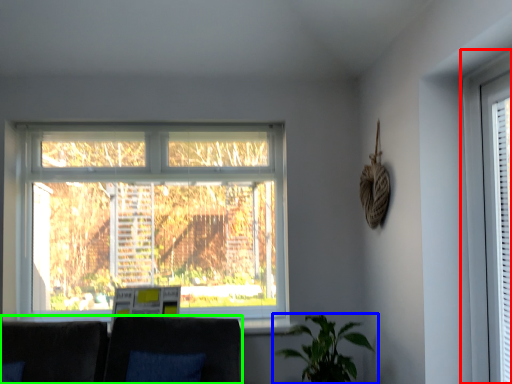
Question: Considering the real-world distances, which object is closest to window (highlighted by a red box)? houseplant (highlighted by a blue box) or couch (highlighted by a green box).

Choices:
 (A) houseplant
 (B) couch

Answer: (A)